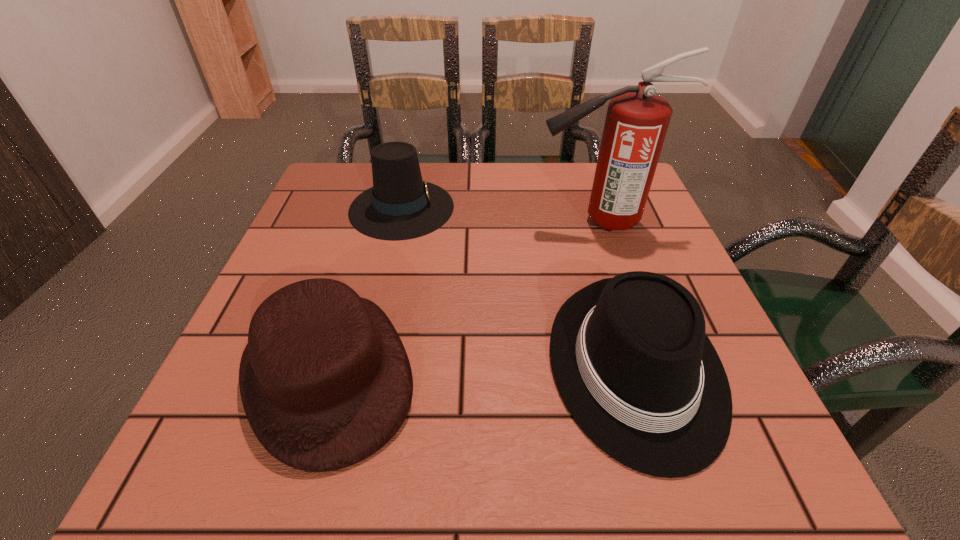
Find the location of a particular element. The image size is (960, 540). hat at the far edge is located at coordinates (400, 206).

The width and height of the screenshot is (960, 540). Find the location of `fedora located at the near edge`. fedora located at the near edge is located at coordinates (630, 356).

Locate an element on the screen. This screenshot has width=960, height=540. hat at the near edge is located at coordinates (325, 381).

The height and width of the screenshot is (540, 960). Identify the location of fire extinguisher present at the right edge. (637, 120).

Identify the location of fedora positioned at the right edge. The height and width of the screenshot is (540, 960). (630, 356).

This screenshot has height=540, width=960. What are the coordinates of `object that is at the far left corner` in the screenshot? It's located at (400, 206).

Find the location of `object present at the near left corner`. object present at the near left corner is located at coordinates (325, 381).

Locate an element on the screen. Image resolution: width=960 pixels, height=540 pixels. object that is at the far right corner is located at coordinates (637, 120).

I want to click on object at the near right corner, so click(630, 356).

The height and width of the screenshot is (540, 960). In order to click on vacant space at the far edge of the desktop in this screenshot , I will do `click(530, 180)`.